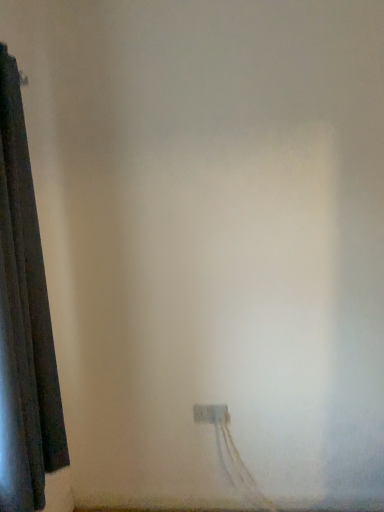
What do you see at coordinates (24, 322) in the screenshot? I see `dark fabric curtain at left` at bounding box center [24, 322].

Where is `dark fabric curtain at left`? The width and height of the screenshot is (384, 512). dark fabric curtain at left is located at coordinates (24, 322).

Locate an element on the screen. The image size is (384, 512). white plastic power plugs and sockets at lower center is located at coordinates (211, 414).

What do you see at coordinates (211, 414) in the screenshot? The width and height of the screenshot is (384, 512). I see `white plastic power plugs and sockets at lower center` at bounding box center [211, 414].

Locate an element on the screen. The image size is (384, 512). dark fabric curtain at left is located at coordinates 24,322.

Considering the positions of objects dark fabric curtain at left and white plastic power plugs and sockets at lower center in the image provided, who is more to the right, dark fabric curtain at left or white plastic power plugs and sockets at lower center?

Positioned to the right is white plastic power plugs and sockets at lower center.

Which is in front, dark fabric curtain at left or white plastic power plugs and sockets at lower center?

dark fabric curtain at left.

Does point (13, 131) appear closer or farther from the camera than point (196, 416)?

Point (13, 131) is positioned closer to the camera compared to point (196, 416).

From the image's perspective, is dark fabric curtain at left below white plastic power plugs and sockets at lower center?

No, from the image's perspective, dark fabric curtain at left is not beneath white plastic power plugs and sockets at lower center.

From a real-world perspective, is dark fabric curtain at left physically located above or below white plastic power plugs and sockets at lower center?

From a real-world perspective, dark fabric curtain at left is physically above white plastic power plugs and sockets at lower center.

Can you confirm if dark fabric curtain at left is wider than white plastic power plugs and sockets at lower center?

Yes.

Between dark fabric curtain at left and white plastic power plugs and sockets at lower center, which one has more height?

Standing taller between the two is dark fabric curtain at left.

Which of these two, dark fabric curtain at left or white plastic power plugs and sockets at lower center, is bigger?

dark fabric curtain at left.

Is dark fabric curtain at left not within white plastic power plugs and sockets at lower center?

Yes, dark fabric curtain at left is outside of white plastic power plugs and sockets at lower center.

Is dark fabric curtain at left next to white plastic power plugs and sockets at lower center?

There is a gap between dark fabric curtain at left and white plastic power plugs and sockets at lower center.

Is dark fabric curtain at left looking in the opposite direction of white plastic power plugs and sockets at lower center?

No, dark fabric curtain at left is not facing away from white plastic power plugs and sockets at lower center.

How different are the orientations of dark fabric curtain at left and white plastic power plugs and sockets at lower center in degrees?

The facing directions of dark fabric curtain at left and white plastic power plugs and sockets at lower center are 90 degrees apart.

Image resolution: width=384 pixels, height=512 pixels. I want to click on power plugs and sockets below the dark fabric curtain at left (from the image's perspective), so click(211, 414).

Considering the relative positions of white plastic power plugs and sockets at lower center and dark fabric curtain at left in the image provided, is white plastic power plugs and sockets at lower center to the left or to the right of dark fabric curtain at left?

From the image, it's evident that white plastic power plugs and sockets at lower center is to the right of dark fabric curtain at left.

Which object is closer to the camera taking this photo, white plastic power plugs and sockets at lower center or dark fabric curtain at left?

dark fabric curtain at left is in front.

Which is farther from the camera, [203,412] or [8,431]?

The point [203,412] is farther.

From the image's perspective, relative to dark fabric curtain at left, is white plastic power plugs and sockets at lower center above or below?

From the image's perspective, white plastic power plugs and sockets at lower center appears below dark fabric curtain at left.

From a real-world perspective, who is located lower, white plastic power plugs and sockets at lower center or dark fabric curtain at left?

white plastic power plugs and sockets at lower center is physically lower.

Is white plastic power plugs and sockets at lower center wider or thinner than dark fabric curtain at left?

Considering their sizes, white plastic power plugs and sockets at lower center looks slimmer than dark fabric curtain at left.

Which of these two, white plastic power plugs and sockets at lower center or dark fabric curtain at left, stands taller?

With more height is dark fabric curtain at left.

Considering the relative sizes of white plastic power plugs and sockets at lower center and dark fabric curtain at left in the image provided, is white plastic power plugs and sockets at lower center bigger than dark fabric curtain at left?

No, white plastic power plugs and sockets at lower center is not bigger than dark fabric curtain at left.

Is dark fabric curtain at left surrounded by white plastic power plugs and sockets at lower center?

That's incorrect, dark fabric curtain at left is not inside white plastic power plugs and sockets at lower center.

Is white plastic power plugs and sockets at lower center far away from dark fabric curtain at left?

No, white plastic power plugs and sockets at lower center is in close proximity to dark fabric curtain at left.

Is white plastic power plugs and sockets at lower center oriented towards dark fabric curtain at left?

No, white plastic power plugs and sockets at lower center is not aimed at dark fabric curtain at left.

How different are the orientations of white plastic power plugs and sockets at lower center and dark fabric curtain at left in degrees?

90 degrees separate the facing orientations of white plastic power plugs and sockets at lower center and dark fabric curtain at left.

Could you measure the distance between white plastic power plugs and sockets at lower center and dark fabric curtain at left?

white plastic power plugs and sockets at lower center and dark fabric curtain at left are 37.27 inches apart.

I want to click on power plugs and sockets behind the dark fabric curtain at left, so pyautogui.click(x=211, y=414).

Image resolution: width=384 pixels, height=512 pixels. I want to click on power plugs and sockets below the dark fabric curtain at left (from a real-world perspective), so click(x=211, y=414).

Where is `power plugs and sockets behind the dark fabric curtain at left`? This screenshot has height=512, width=384. power plugs and sockets behind the dark fabric curtain at left is located at coordinates (x=211, y=414).